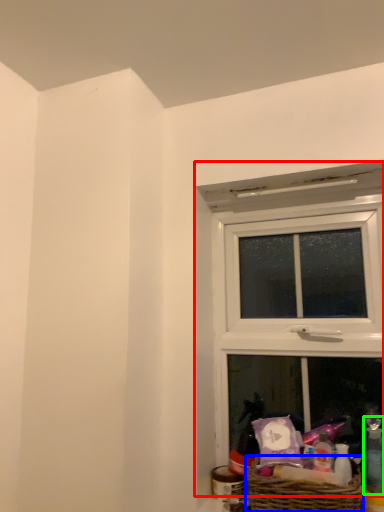
Question: Which object is positioned farthest from window (highlighted by a red box)? Select from picnic basket (highlighted by a blue box) and toiletry (highlighted by a green box).

Choices:
 (A) picnic basket
 (B) toiletry

Answer: (B)